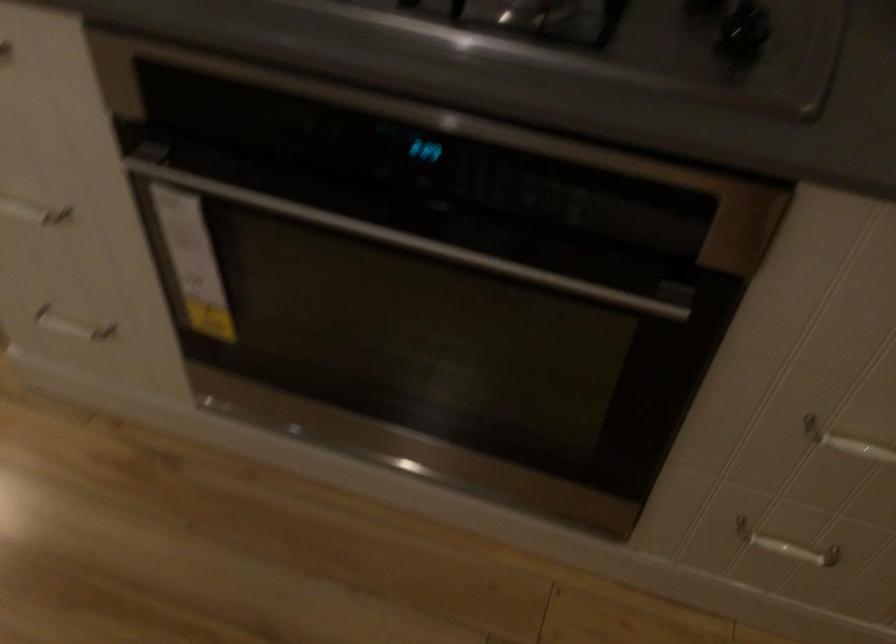
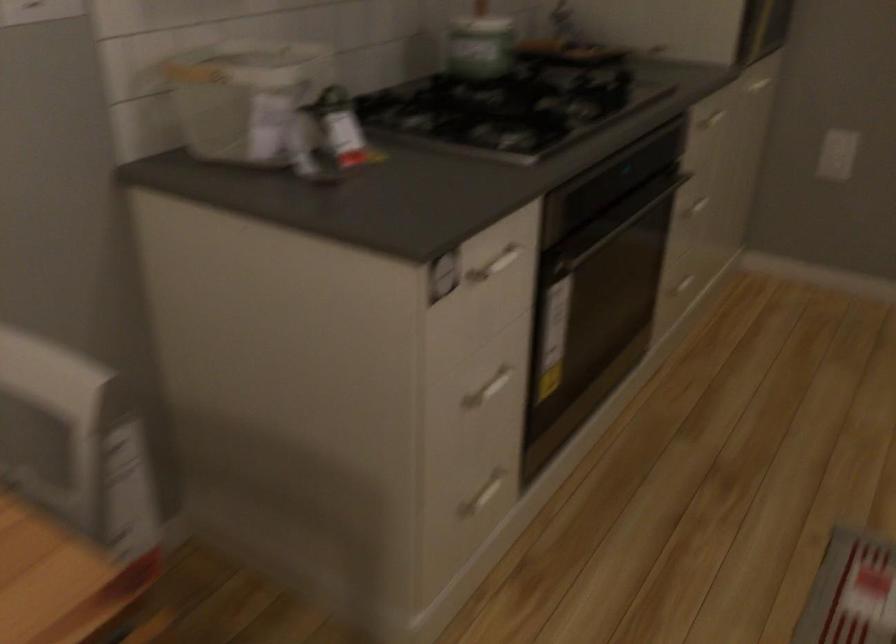
In the second image, find the point that corresponds to point (78, 225) in the first image.

(487, 389)